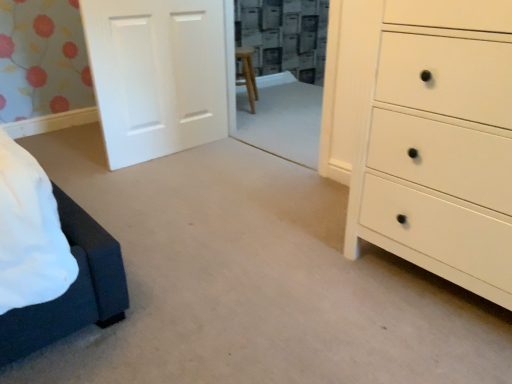
Question: Can you confirm if white matte chest of drawers at right is smaller than white matte door at upper left?

Choices:
 (A) yes
 (B) no

Answer: (B)

Question: Considering the relative sizes of white matte chest of drawers at right and white matte door at upper left in the image provided, is white matte chest of drawers at right bigger than white matte door at upper left?

Choices:
 (A) no
 (B) yes

Answer: (B)

Question: From a real-world perspective, is white matte chest of drawers at right on white matte door at upper left?

Choices:
 (A) no
 (B) yes

Answer: (B)

Question: Is white matte chest of drawers at right positioned with its back to white matte door at upper left?

Choices:
 (A) no
 (B) yes

Answer: (A)

Question: Could you tell me if white matte chest of drawers at right is facing white matte door at upper left?

Choices:
 (A) no
 (B) yes

Answer: (A)

Question: Is white matte chest of drawers at right further to camera compared to white matte door at upper left?

Choices:
 (A) yes
 (B) no

Answer: (B)

Question: Does white matte door at upper left lie behind white matte chest of drawers at right?

Choices:
 (A) yes
 (B) no

Answer: (A)

Question: Can you confirm if white matte door at upper left is bigger than white matte chest of drawers at right?

Choices:
 (A) no
 (B) yes

Answer: (A)

Question: From the image's perspective, is white matte door at upper left on white matte chest of drawers at right?

Choices:
 (A) no
 (B) yes

Answer: (B)

Question: Can you confirm if white matte door at upper left is shorter than white matte chest of drawers at right?

Choices:
 (A) yes
 (B) no

Answer: (A)

Question: Is white matte door at upper left not close to white matte chest of drawers at right?

Choices:
 (A) yes
 (B) no

Answer: (A)

Question: Does white matte door at upper left have a lesser width compared to white matte chest of drawers at right?

Choices:
 (A) no
 (B) yes

Answer: (B)

Question: From the image's perspective, is white matte door at upper left positioned above or below white matte chest of drawers at right?

Choices:
 (A) below
 (B) above

Answer: (B)